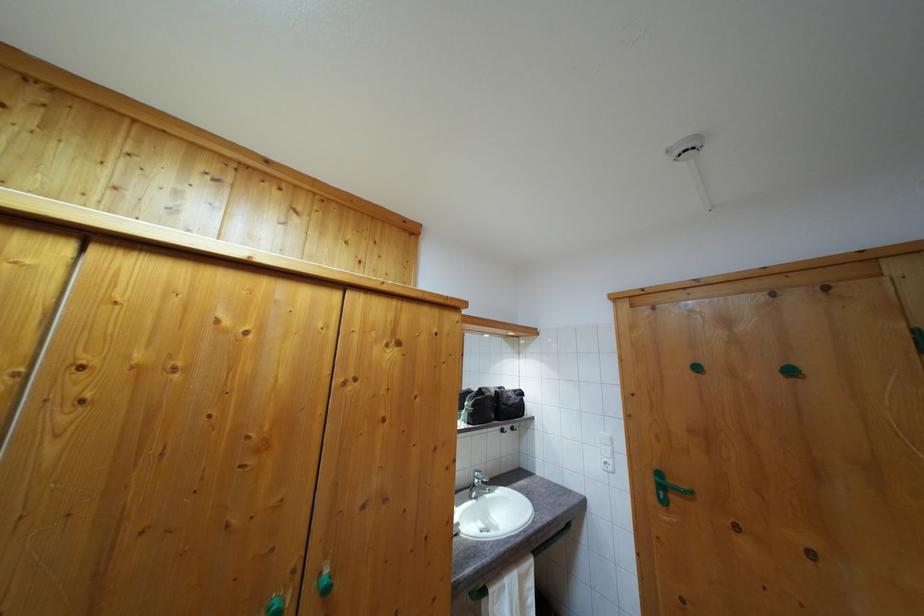
This screenshot has width=924, height=616. I want to click on green door knob, so click(698, 369).